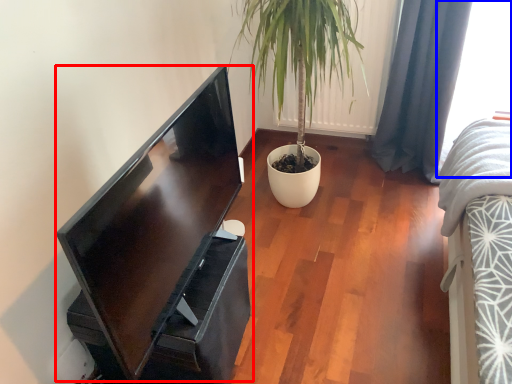
Question: Which object appears closest to the camera in this image, computer monitor (highlighted by a red box) or window (highlighted by a blue box)?

Choices:
 (A) computer monitor
 (B) window

Answer: (A)